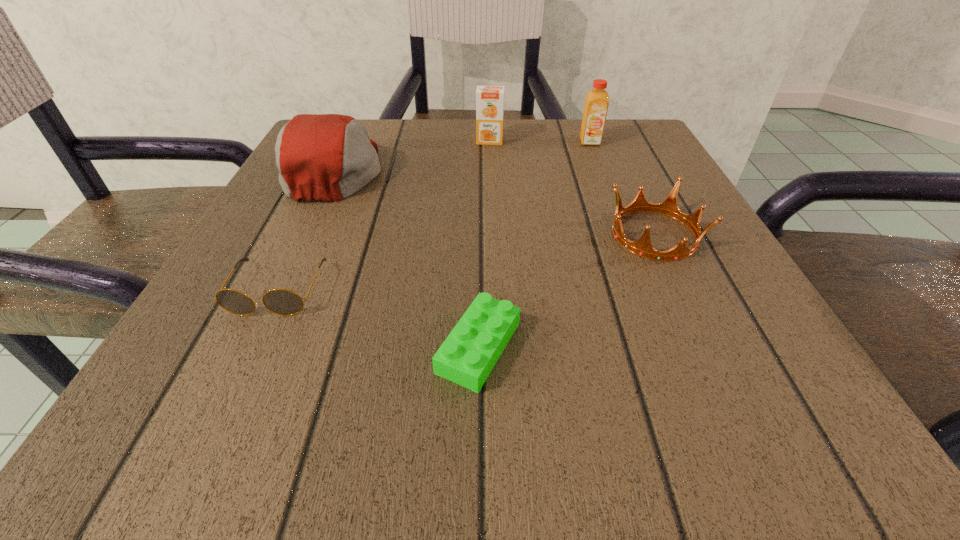
Identify the location of object situated at the far right corner. (597, 100).

This screenshot has height=540, width=960. In the image, there is a desktop. What are the coordinates of `vacant space at the far edge` in the screenshot? It's located at (548, 133).

This screenshot has height=540, width=960. In order to click on free space at the near edge in this screenshot , I will do [x=371, y=376].

In the image, there is a desktop. Identify the location of free region at the left edge. This screenshot has height=540, width=960. (260, 287).

This screenshot has width=960, height=540. Find the location of `free region at the right edge of the desktop`. free region at the right edge of the desktop is located at coordinates (705, 237).

Locate an element on the screen. The image size is (960, 540). vacant space at the near left corner of the desktop is located at coordinates (169, 389).

The image size is (960, 540). In the image, there is a desktop. Identify the location of vacant space at the far right corner. (618, 133).

At what (x,y) coordinates should I click in order to perform the action: click on free spot at the near right corner of the desktop. Please return your answer as a coordinate pair (x, y). This screenshot has width=960, height=540. Looking at the image, I should click on (785, 418).

The width and height of the screenshot is (960, 540). Find the location of `free space between the cap and the right orange juice`. free space between the cap and the right orange juice is located at coordinates (463, 156).

Where is `vacant area that lies between the cap and the right orange juice`? vacant area that lies between the cap and the right orange juice is located at coordinates (x=463, y=156).